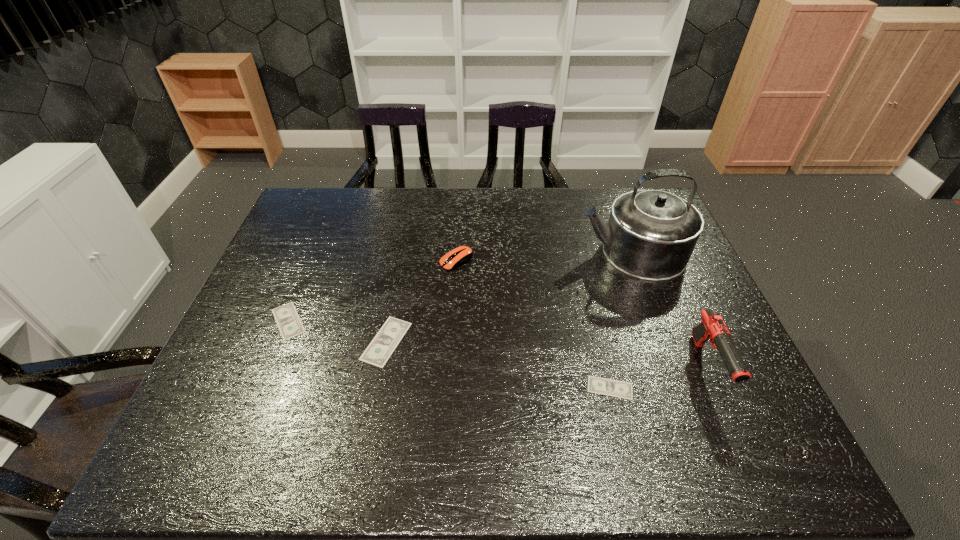
This screenshot has height=540, width=960. Identify the location of vacant space located on the right of the fifth tallest object. (408, 321).

Where is `free spot located 0.050m on the back of the tallest money`? free spot located 0.050m on the back of the tallest money is located at coordinates (394, 303).

What are the coordinates of `free space located on the left of the shortest money` in the screenshot? It's located at (535, 388).

You are a GUI agent. You are given a task and a screenshot of the screen. Output one action in this format:
    pyautogui.click(x=<x>, y=<y>)
    Task: Click on the vacant space located on the front of the third tallest object
    
    Given the screenshot: What is the action you would take?
    pyautogui.click(x=449, y=383)

This screenshot has width=960, height=540. I want to click on free space located 0.190m with the spout at the front of the tallest object, so click(x=516, y=252).

This screenshot has width=960, height=540. Find the location of `vacant area situated with the spout at the front of the tallest object`. vacant area situated with the spout at the front of the tallest object is located at coordinates (512, 252).

Image resolution: width=960 pixels, height=540 pixels. I want to click on vacant position located 0.140m with the spout at the front of the tallest object, so click(x=532, y=252).

I want to click on object that is positioned at the far edge, so click(x=651, y=234).

Find the location of a particular element. The height and width of the screenshot is (540, 960). money situated at the near edge is located at coordinates (614, 388).

Locate an element on the screen. The width and height of the screenshot is (960, 540). gun located at the near edge is located at coordinates (712, 328).